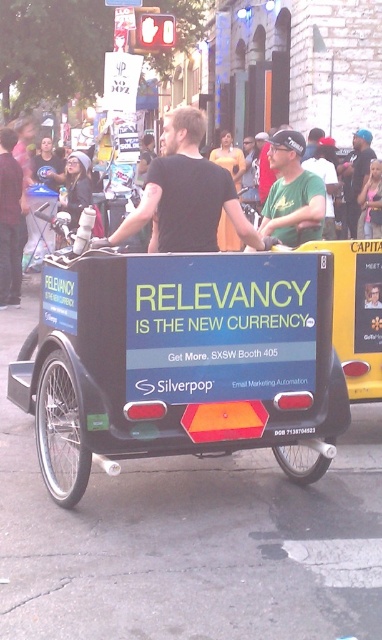
Is point (323, 182) in front of point (341, 172)?

That is True.

The image size is (382, 640). What do you see at coordinates (292, 193) in the screenshot? I see `green matte shirt at center` at bounding box center [292, 193].

You are a GUI agent. You are given a task and a screenshot of the screen. Output one action in this format:
    pyautogui.click(x=<x>, y=<y>)
    Task: Click on the green matte shirt at center
    This screenshot has width=382, height=640.
    Given the screenshot: What is the action you would take?
    pyautogui.click(x=292, y=193)

Is black matte shirt at center to the right of dark blue t-shirt at center from the viewer's perspective?

Incorrect, black matte shirt at center is not on the right side of dark blue t-shirt at center.

Describe the element at coordinates (186, 193) in the screenshot. The image size is (382, 640). I see `black matte shirt at center` at that location.

Is point (137, 209) more distant than point (356, 179)?

That is False.

In order to click on black matte shirt at center in this screenshot , I will do `click(186, 193)`.

Between black matte shirt at center and green matte shirt at center, which one is positioned lower?

black matte shirt at center

You are a GUI agent. You are given a task and a screenshot of the screen. Output one action in this format:
    pyautogui.click(x=<x>, y=<y>)
    Task: Click on the black matte shirt at center
    The image size is (382, 640).
    Given the screenshot: What is the action you would take?
    pyautogui.click(x=186, y=193)